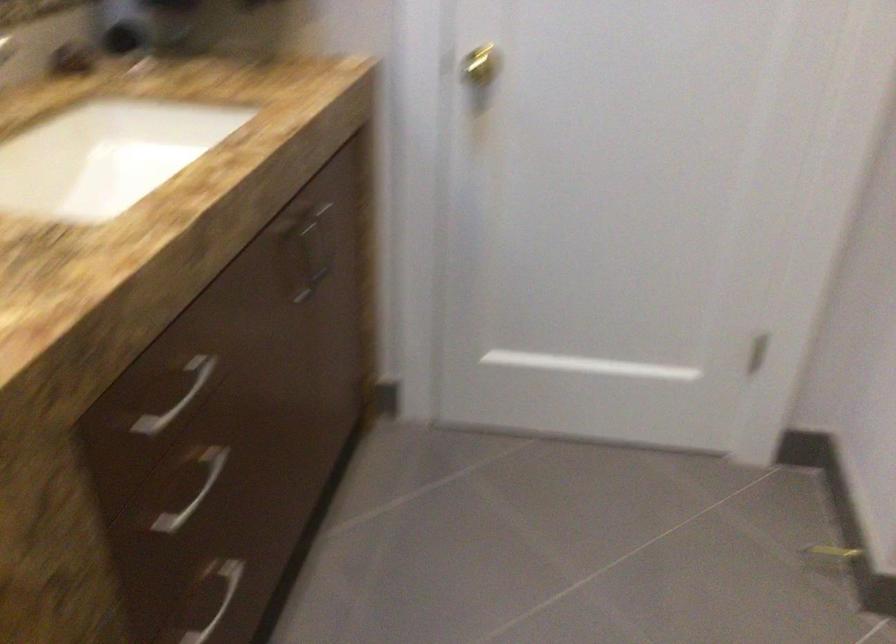
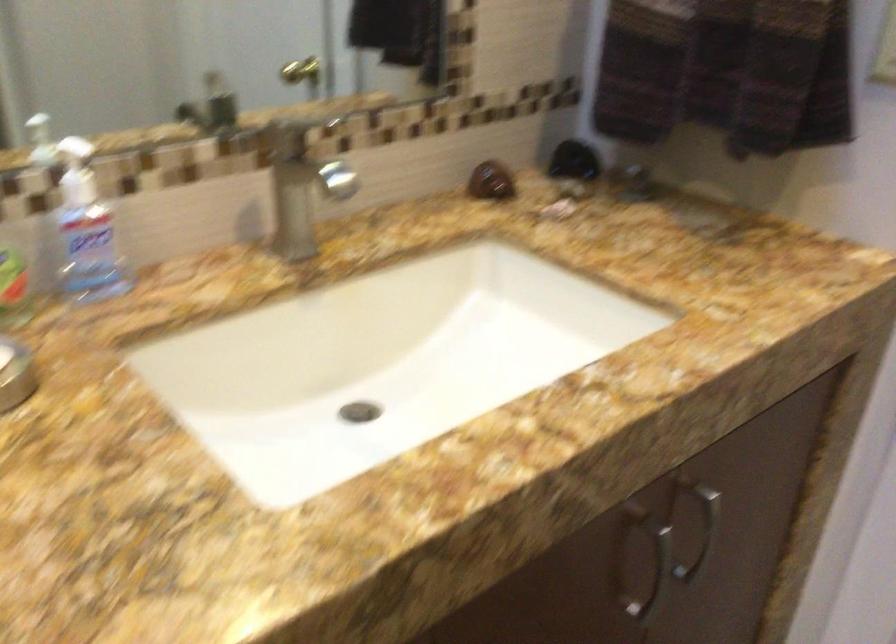
Locate, in the second image, the point that corresponds to the point at 297,269 in the first image.

(642, 565)